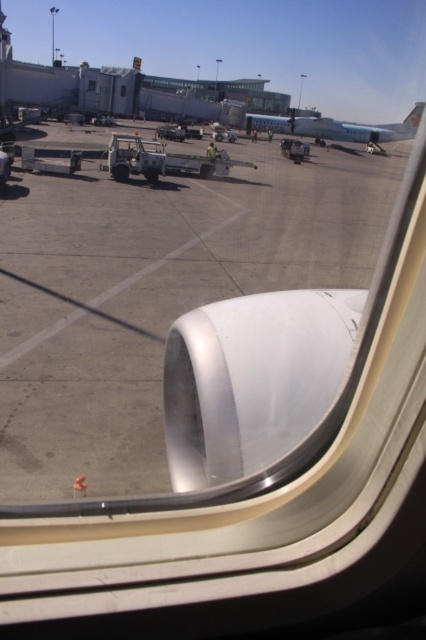
You are a flight attendant on an airplane and you need to check the status of the aircraft engine. You look through the transparent glass window at center and see the white matte airplane at upper center. Which object is taller when viewed from your perspective?

A: The white matte airplane at upper center is taller than the transparent glass window at center when viewed from your perspective.

You are sitting in an airplane seat and looking out the window. You notice the white matte airplane at upper center and the transparent glass window at center. Which object is closer to you?

The white matte airplane at upper center is closer to you than the transparent glass window at center.